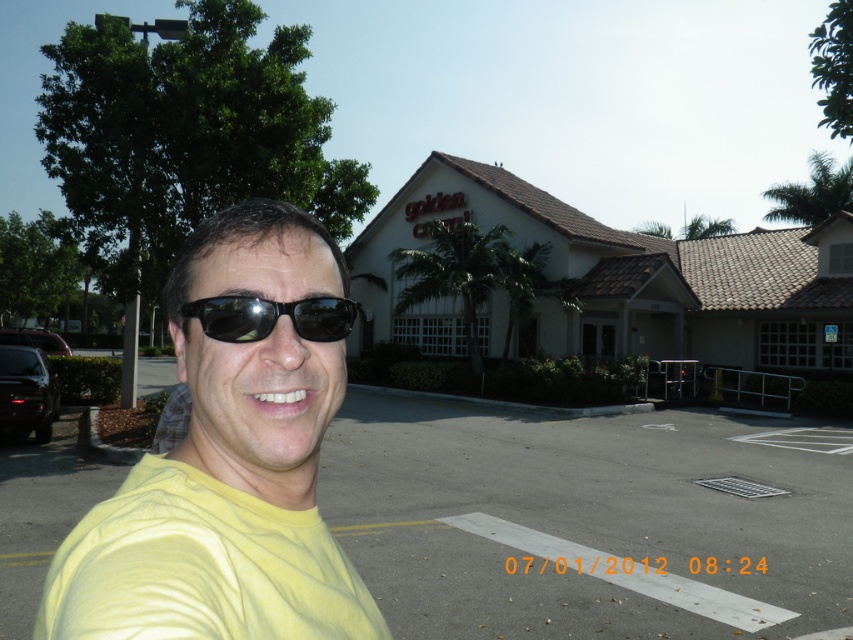
Between point (228, 244) and point (223, 310), which one is positioned in front?

Point (223, 310) is more forward.

Is yellow matte shirt at center below black matte sunglasses at center?

Yes.

The width and height of the screenshot is (853, 640). Find the location of `yellow matte shirt at center`. yellow matte shirt at center is located at coordinates (230, 458).

Is point (788, 621) farther from camera compared to point (315, 316)?

Yes, it is.

Between point (67, 496) and point (219, 314), which one is positioned behind?

Positioned behind is point (67, 496).

You are a GUI agent. You are given a task and a screenshot of the screen. Output one action in this format:
    pyautogui.click(x=<x>, y=<y>)
    Task: Click on the gray asphalt parking lot at center
    The width and height of the screenshot is (853, 640).
    Given the screenshot: What is the action you would take?
    pyautogui.click(x=587, y=520)

Who is more forward, [755,444] or [193,353]?

Point [193,353]

Is gray asphalt parking lot at center further to camera compared to yellow matte shirt at center?

Yes.

The height and width of the screenshot is (640, 853). What do you see at coordinates (587, 520) in the screenshot?
I see `gray asphalt parking lot at center` at bounding box center [587, 520].

Find the location of a particular element. The width and height of the screenshot is (853, 640). gray asphalt parking lot at center is located at coordinates pyautogui.click(x=587, y=520).